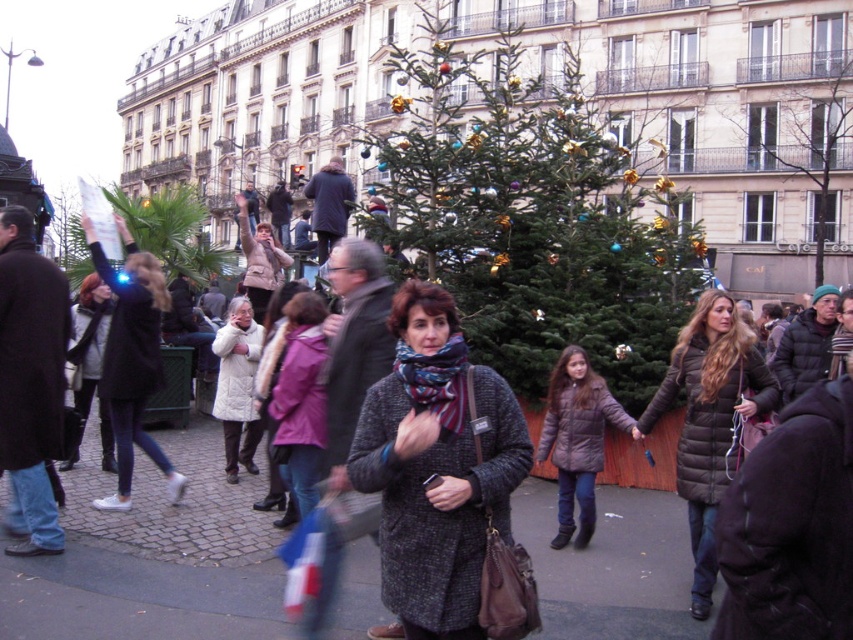
You are a fashion designer observing the holiday street scene. You notice two coats in the crowd. Which one has a larger size between the knitted wool coat at center and the purple fleece jacket at center?

The knitted wool coat at center is bigger than the purple fleece jacket at center, so the knitted wool coat at center has a larger size.